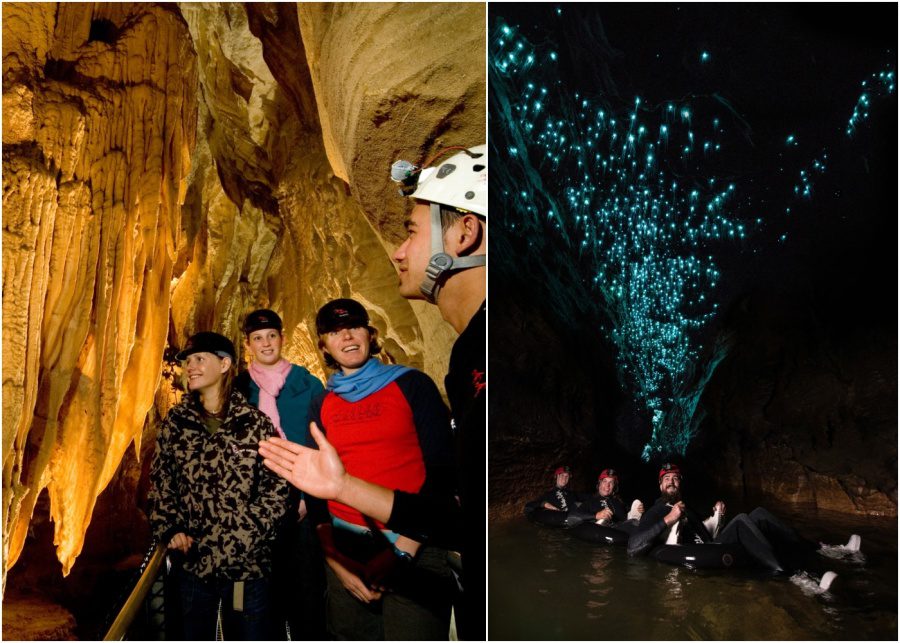
Where is `panel`? The image size is (900, 643). panel is located at coordinates (380, 308), (518, 320).